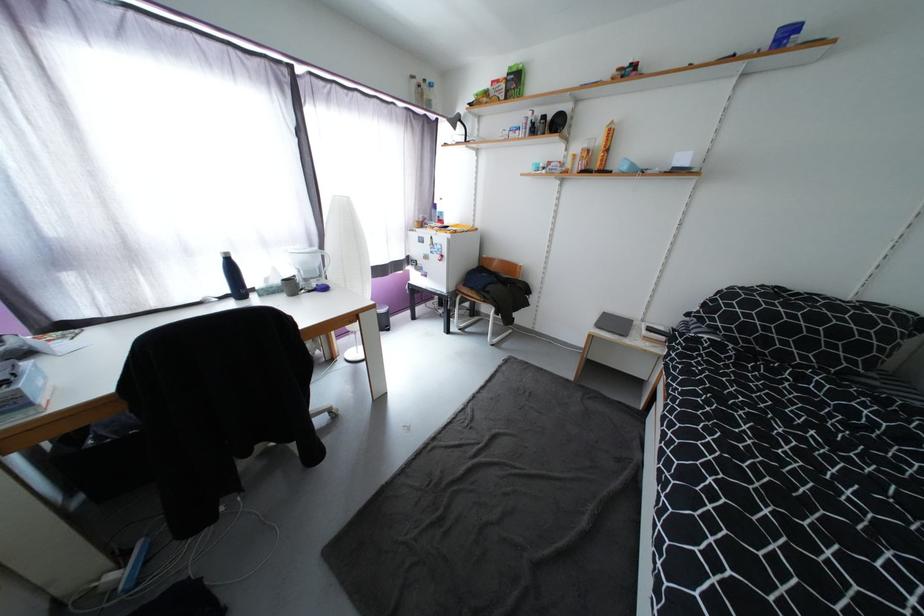
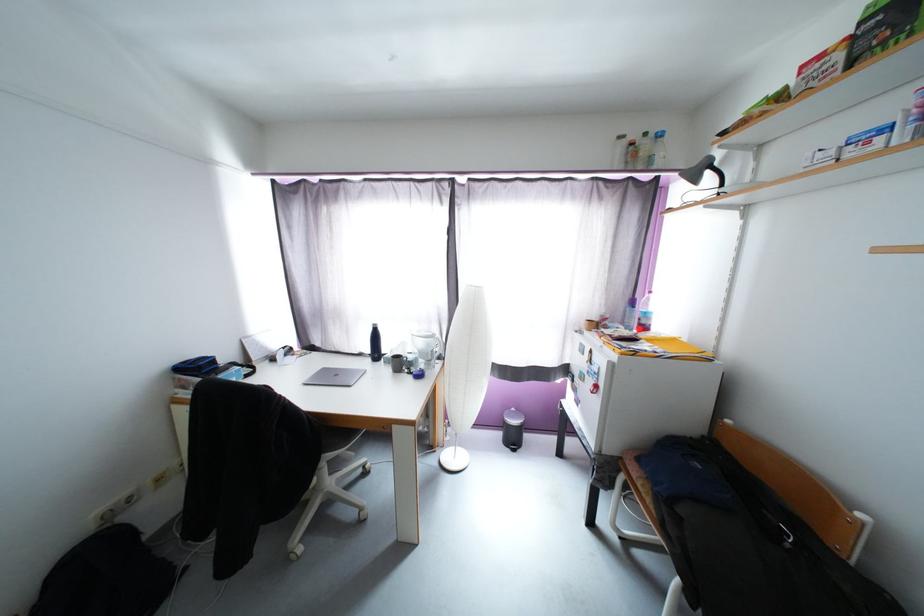
Find the pixel in the second image that matches the point at 439,213 in the first image.

(634, 310)